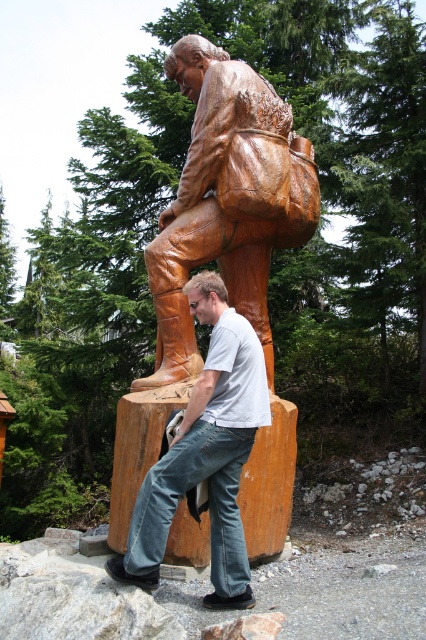
In the scene shown: You are a photographer trying to capture the matte brown boot at center and the natural wood log at center in the same frame. Based on their positions, which object should you adjust your camera angle to focus on first if you want to include both in your shot?

The matte brown boot at center is to the left of natural wood log at center, so you should adjust your camera angle to focus on the matte brown boot at center first to ensure both objects are included in the shot.

You are a photographer trying to capture the perfect shot of the matte brown boot at center. Based on its position, where would you aim your camera to ensure the boot is centered in the frame?

The matte brown boot at center is located at the 2D coordinates point (206,452), so you should aim your camera at that point to center the boot in the frame.